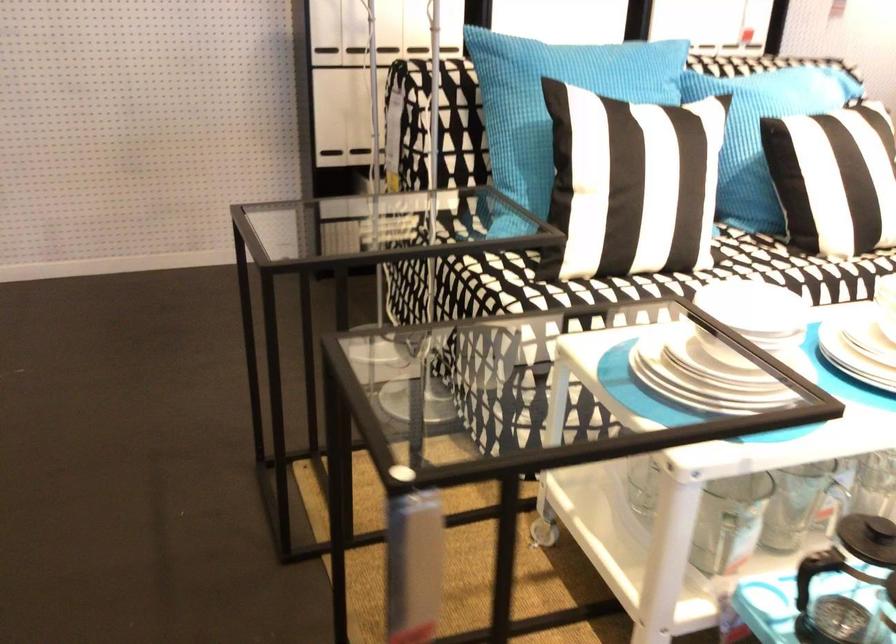
Where would you grasp the black press handle? Please return your answer as a coordinate pair (x, y).

(867, 538)